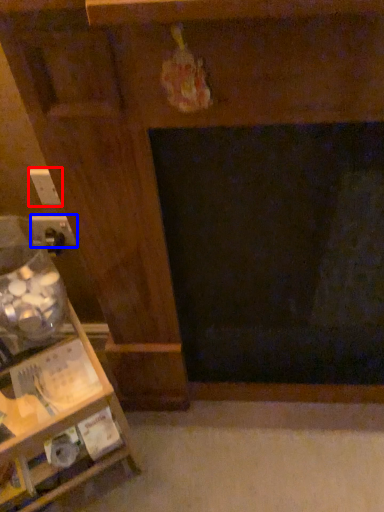
Question: Among these objects, which one is nearest to the camera, electric outlet (highlighted by a red box) or electric outlet (highlighted by a blue box)?

Choices:
 (A) electric outlet
 (B) electric outlet

Answer: (A)